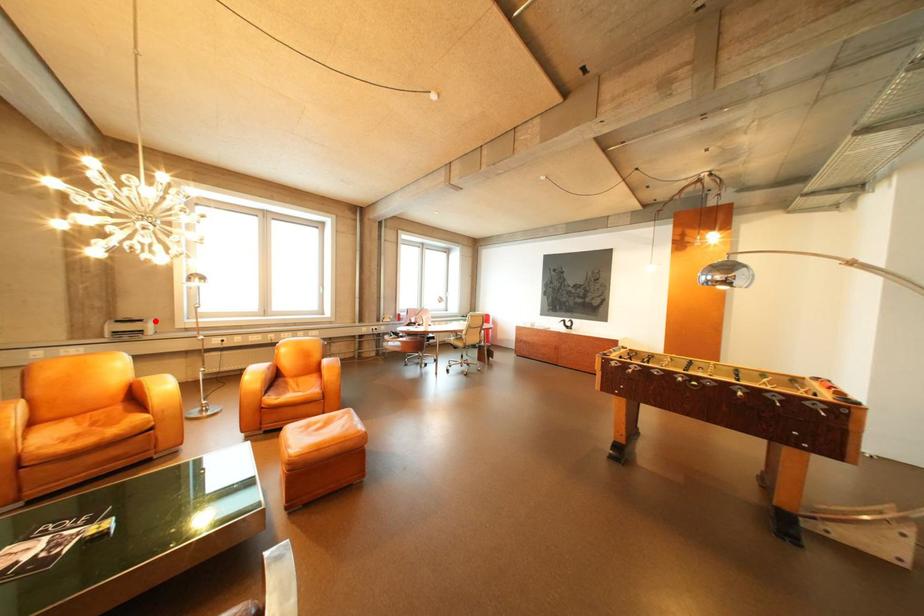
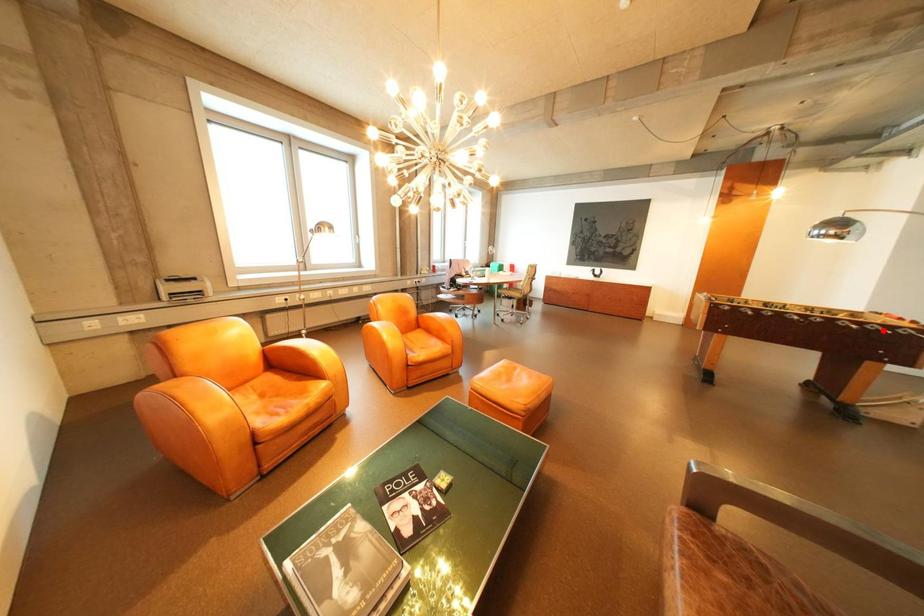
I am providing you with two images of the same scene from different viewpoints. A red point is marked on the first image and another point is marked on the second image. Is the marked point in image1 the same physical position as the marked point in image2?

No